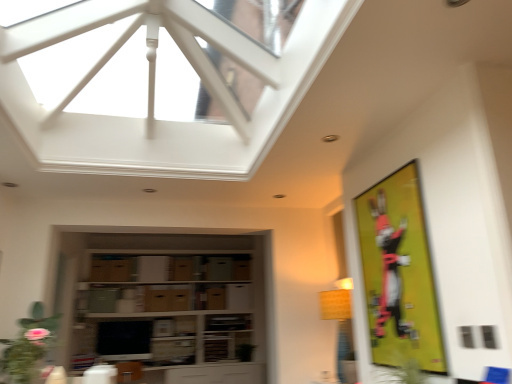
In order to face matte wooden entertainment center at center, should I rotate leftwards or rightwards?

It's best to rotate left around 11.126 degrees.

Looking at this image, what is the approximate height of yellow matte bulletin board at right?

It is 1.04 meters.

Identify the location of matte black monitor at center. (124, 340).

Relative to yellow matte bulletin board at right, is white glass window at upper center in front or behind?

Visually, white glass window at upper center is located in front of yellow matte bulletin board at right.

How different are the orientations of white glass window at upper center and yellow matte bulletin board at right in degrees?

The facing directions of white glass window at upper center and yellow matte bulletin board at right are 180 degrees apart.

Is white glass window at upper center situated inside yellow matte bulletin board at right or outside?

white glass window at upper center exists outside the volume of yellow matte bulletin board at right.

Are yellow matte bulletin board at right and green matte plant at lower left beside each other?

No, yellow matte bulletin board at right is not with green matte plant at lower left.

From the image's perspective, does yellow matte bulletin board at right appear higher than green matte plant at lower left?

Yes, from the image's perspective, yellow matte bulletin board at right is on top of green matte plant at lower left.

Which object is closer to the camera taking this photo, yellow matte bulletin board at right or green matte plant at lower left?

green matte plant at lower left.

Considering the sizes of objects white glass window at upper center and matte wooden entertainment center at center in the image provided, who is wider, white glass window at upper center or matte wooden entertainment center at center?

With larger width is white glass window at upper center.

Who is smaller, white glass window at upper center or matte wooden entertainment center at center?

matte wooden entertainment center at center is smaller.

Identify the location of window that appears above the matte wooden entertainment center at center (from a real-world perspective). The height and width of the screenshot is (384, 512). (159, 85).

From the image's perspective, relative to green matte plant at lower left, is matte wooden entertainment center at center above or below?

matte wooden entertainment center at center is below green matte plant at lower left.

Which of these two, matte wooden entertainment center at center or green matte plant at lower left, stands taller?

With more height is matte wooden entertainment center at center.

Could you tell me if matte wooden entertainment center at center is turned towards green matte plant at lower left?

Yes, matte wooden entertainment center at center is oriented towards green matte plant at lower left.

Which is closer to the camera, (172,302) or (141,32)?

Point (172,302) is positioned farther from the camera compared to point (141,32).

You are a GUI agent. You are given a task and a screenshot of the screen. Output one action in this format:
    pyautogui.click(x=<x>, y=<y>)
    Task: Click on the entertainment center below the white glass window at upper center (from the image's perspective)
    The image size is (512, 384).
    Given the screenshot: What is the action you would take?
    pyautogui.click(x=167, y=303)

From the picture: Considering the sizes of objects matte wooden entertainment center at center and white glass window at upper center in the image provided, who is smaller, matte wooden entertainment center at center or white glass window at upper center?

Smaller between the two is matte wooden entertainment center at center.

What's the angular difference between matte wooden entertainment center at center and white glass window at upper center's facing directions?

The facing directions of matte wooden entertainment center at center and white glass window at upper center are 90.5 degrees apart.

Relative to white glass window at upper center, is matte black monitor at center in front or behind?

In the image, matte black monitor at center appears behind white glass window at upper center.

I want to click on window screen on the left side of white glass window at upper center, so click(x=124, y=340).

Which is less distant, (x=138, y=326) or (x=155, y=66)?

Point (x=138, y=326) is farther from the camera than point (x=155, y=66).

What's the angular difference between matte black monitor at center and white glass window at upper center's facing directions?

The facing directions of matte black monitor at center and white glass window at upper center are 88.6 degrees apart.

From the image's perspective, which object appears higher, matte black monitor at center or matte wooden entertainment center at center?

matte wooden entertainment center at center, from the image's perspective.

Relative to matte wooden entertainment center at center, is matte black monitor at center in front or behind?

Clearly, matte black monitor at center is behind matte wooden entertainment center at center.

Is matte black monitor at center wider or thinner than matte wooden entertainment center at center?

Considering their sizes, matte black monitor at center looks slimmer than matte wooden entertainment center at center.

Measure the distance between matte black monitor at center and matte wooden entertainment center at center.

matte black monitor at center and matte wooden entertainment center at center are 22.50 inches apart from each other.

Where is `bulletin board directly beneath the white glass window at upper center (from a real-world perspective)`? bulletin board directly beneath the white glass window at upper center (from a real-world perspective) is located at coordinates tap(399, 273).

Identify the location of plant in front of the yellow matte bulletin board at right. (28, 346).

Looking at the image, which one is located further to matte black monitor at center, matte wooden entertainment center at center or white glass window at upper center?

white glass window at upper center is positioned further to the anchor matte black monitor at center.

Based on their spatial positions, is matte black monitor at center or matte wooden entertainment center at center closer to green matte plant at lower left?

Based on the image, matte wooden entertainment center at center appears to be nearer to green matte plant at lower left.

From the image, which object appears to be nearer to yellow matte bulletin board at right, matte wooden entertainment center at center or green matte plant at lower left?

green matte plant at lower left is closer to yellow matte bulletin board at right.

From the image, which object appears to be nearer to matte black monitor at center, green matte plant at lower left or yellow matte bulletin board at right?

Based on the image, green matte plant at lower left appears to be nearer to matte black monitor at center.

Based on their spatial positions, is green matte plant at lower left or matte black monitor at center further from white glass window at upper center?

matte black monitor at center.

Which object lies further to the anchor point yellow matte bulletin board at right, green matte plant at lower left or white glass window at upper center?

Based on the image, green matte plant at lower left appears to be further to yellow matte bulletin board at right.

From the image, which object appears to be farther from yellow matte bulletin board at right, green matte plant at lower left or matte black monitor at center?

matte black monitor at center is positioned further to the anchor yellow matte bulletin board at right.

From the image, which object appears to be farther from matte black monitor at center, green matte plant at lower left or matte wooden entertainment center at center?

green matte plant at lower left.

At what (x,y) coordinates should I click in order to perform the action: click on entertainment center between white glass window at upper center and matte black monitor at center along the z-axis. Please return your answer as a coordinate pair (x, y). The height and width of the screenshot is (384, 512). Looking at the image, I should click on (167, 303).

Where is `bulletin board between white glass window at upper center and matte black monitor at center along the z-axis`? bulletin board between white glass window at upper center and matte black monitor at center along the z-axis is located at coordinates (399, 273).

Where is `entertainment center positioned between yellow matte bulletin board at right and matte black monitor at center from near to far`? This screenshot has width=512, height=384. entertainment center positioned between yellow matte bulletin board at right and matte black monitor at center from near to far is located at coordinates (167, 303).

Where is `bulletin board between white glass window at upper center and matte wooden entertainment center at center in the front-back direction`? Image resolution: width=512 pixels, height=384 pixels. bulletin board between white glass window at upper center and matte wooden entertainment center at center in the front-back direction is located at coordinates (399, 273).